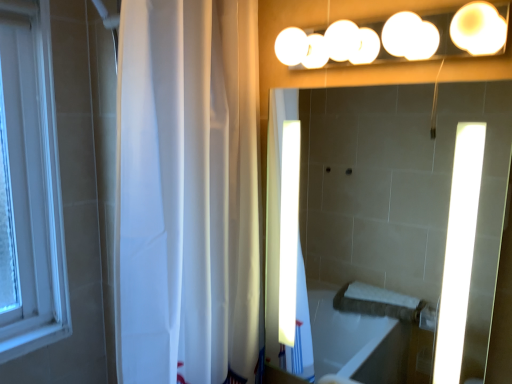
Question: Considering the positions of white glossy lights at upper center and white glossy mirror at upper center in the image, is white glossy lights at upper center bigger or smaller than white glossy mirror at upper center?

Choices:
 (A) small
 (B) big

Answer: (A)

Question: Is point (479, 8) closer or farther from the camera than point (384, 122)?

Choices:
 (A) farther
 (B) closer

Answer: (B)

Question: Considering the real-world distances, which object is farthest from the white glossy lights at upper center?

Choices:
 (A) white glossy mirror at upper center
 (B) white sheer curtain at left

Answer: (A)

Question: Which object is the farthest from the white glossy lights at upper center?

Choices:
 (A) white sheer curtain at left
 (B) white glossy mirror at upper center

Answer: (B)